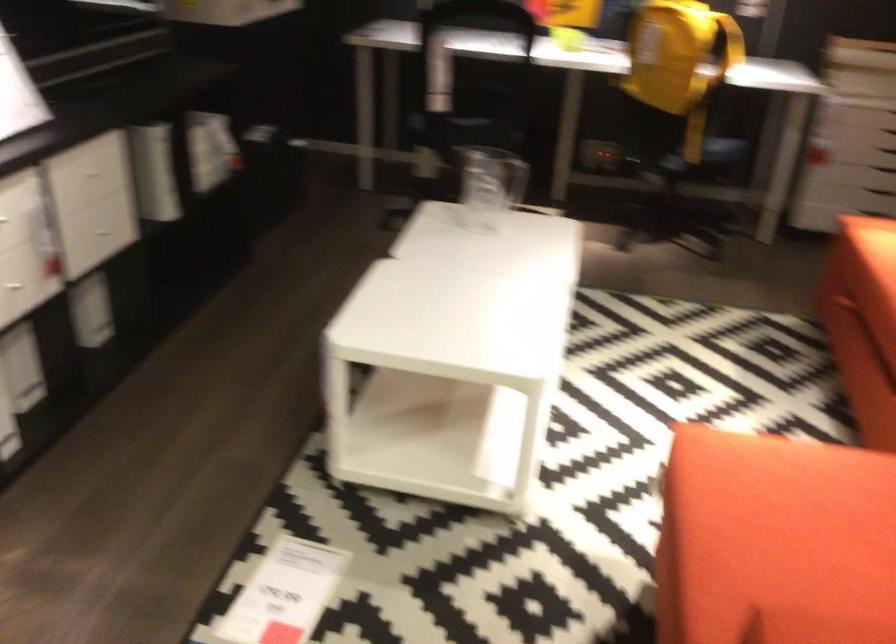
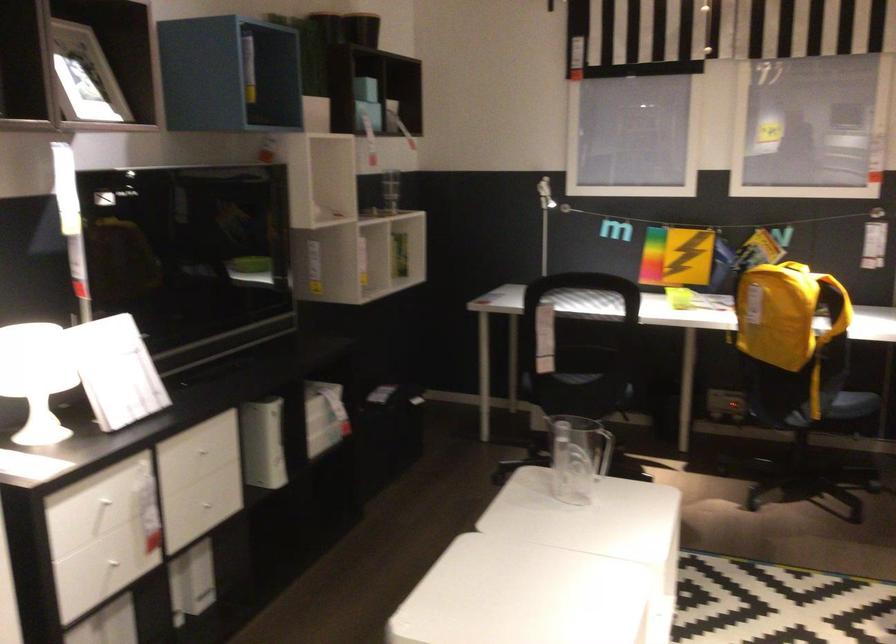
Where in the second image is the point corresponding to point (106, 232) from the first image?

(209, 504)